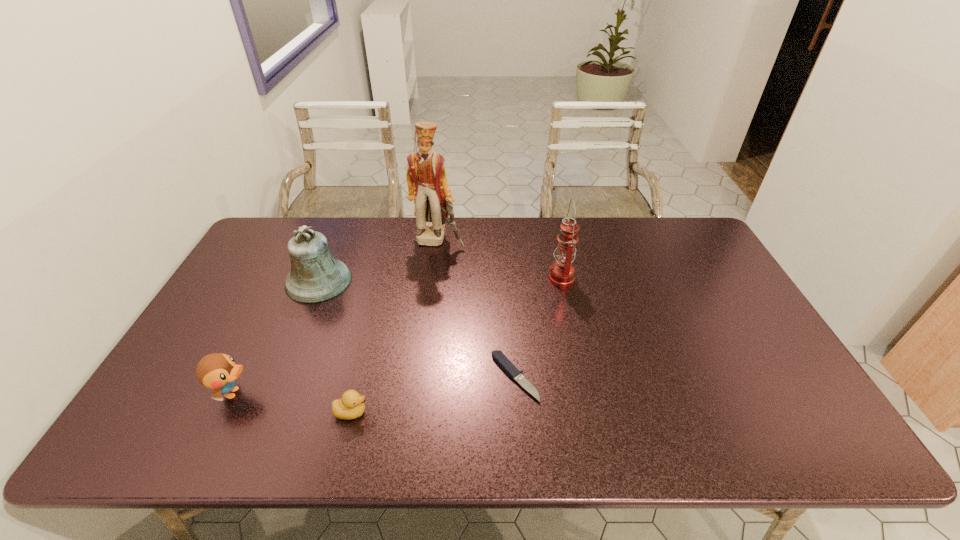
The width and height of the screenshot is (960, 540). Find the location of `the farthest object`. the farthest object is located at coordinates (427, 183).

The width and height of the screenshot is (960, 540). In order to click on the tallest object in this screenshot , I will do `click(427, 183)`.

The image size is (960, 540). Find the location of `the fifth shortest object`. the fifth shortest object is located at coordinates (562, 272).

Where is `oil lamp`? oil lamp is located at coordinates (562, 272).

Identify the location of bell. (316, 276).

Locate an element on the screen. This screenshot has width=960, height=540. the fourth tallest object is located at coordinates (217, 371).

Identify the location of the third object from left to right. Image resolution: width=960 pixels, height=540 pixels. (351, 405).

Locate an element on the screen. The image size is (960, 540). duckling is located at coordinates (351, 405).

Locate an element on the screen. steak knife is located at coordinates (498, 356).

You are a GUI agent. You are given a task and a screenshot of the screen. Output one action in this format:
    pyautogui.click(x=<x>, y=<y>)
    Task: Click on the second object from right to left
    The height and width of the screenshot is (540, 960).
    Given the screenshot: What is the action you would take?
    pyautogui.click(x=498, y=356)